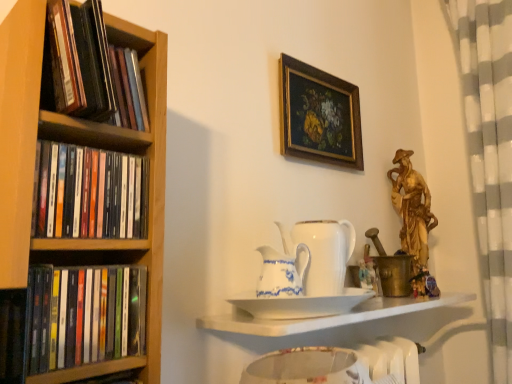
Question: Based on their positions, is brass/metallic candle holder at right located to the left or right of white porcelain teapot at center, which appears as the 2th tea pot when viewed from the front?

Choices:
 (A) left
 (B) right

Answer: (B)

Question: Is brass/metallic candle holder at right inside or outside of white porcelain teapot at center, which appears as the 2th tea pot when viewed from the front?

Choices:
 (A) inside
 (B) outside

Answer: (B)

Question: Considering the real-world distances, which object is farthest from the black matte books at left, positioned as the second book in top-to-bottom order?

Choices:
 (A) black matte book at left, arranged as the 3th book when viewed from the top
 (B) black matte bookshelf at left, the 3th book when ordered from bottom to top
 (C) white glossy shelf at center
 (D) gold metallic statue at upper right
 (E) white porcelain plate at center

Answer: (D)

Question: Estimate the real-world distances between objects in this image. Which object is farther from the white porcelain teapot at center, which appears as the 2th tea pot when viewed from the front?

Choices:
 (A) white glossy shelf at center
 (B) gold metallic statue at upper right
 (C) brass/metallic candle holder at right
 (D) black matte bookshelf at left, the 1th book viewed from the top
 (E) black matte book at left, arranged as the 3th book when viewed from the top

Answer: (B)